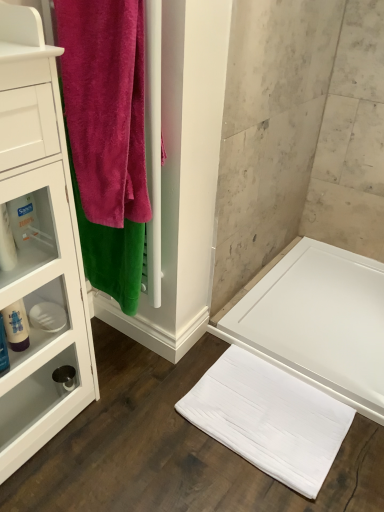
What do you see at coordinates (16, 326) in the screenshot? I see `translucent plastic bottle at left` at bounding box center [16, 326].

At what (x,y) coordinates should I click in order to perform the action: click on matte black faucet at lower left, which ranks as the first toiletry in back-to-front order. Please return your answer as a coordinate pair (x, y). Looking at the image, I should click on (64, 379).

Measure the distance between white glossy bath at lower right and camera.

A distance of 1.40 meters exists between white glossy bath at lower right and camera.

Image resolution: width=384 pixels, height=512 pixels. In order to click on white glossy bath at lower right in this screenshot , I will do `click(319, 322)`.

Where is `white plastic container at left, placed as the third toiletry when sorted from bottom to top`? The height and width of the screenshot is (512, 384). white plastic container at left, placed as the third toiletry when sorted from bottom to top is located at coordinates (6, 242).

What do you see at coordinates (3, 348) in the screenshot?
I see `translucent plastic bottle at left, the 2th toiletry from the back` at bounding box center [3, 348].

Find the location of a particular element. The image size is (384, 512). translucent plastic bottle at left, the 2th toiletry from the back is located at coordinates (3, 348).

You are a GUI agent. You are given a task and a screenshot of the screen. Output one action in this format:
    pyautogui.click(x=<x>, y=<y>)
    Task: Click on the white glossy cabinet at left
    The width and height of the screenshot is (384, 512).
    Given the screenshot: What is the action you would take?
    pyautogui.click(x=39, y=245)

Is velvety pink towel at left at the back of translucent plastic bottle at left, positioned as the second toiletry in front-to-back order?

That's not correct — translucent plastic bottle at left, positioned as the second toiletry in front-to-back order, is not looking away from velvety pink towel at left.

Is translucent plastic bottle at left, positioned as the second toiletry in front-to-back order, taller than velvety pink towel at left?

No, translucent plastic bottle at left, positioned as the second toiletry in front-to-back order, is not taller than velvety pink towel at left.

Between point (3, 353) and point (120, 22), which one is positioned behind?

The point (3, 353) is behind.

Between translucent plastic bottle at left, the 2th toiletry positioned from the top, and velvety pink towel at left, which one is positioned in front?

velvety pink towel at left is closer to the camera.

From a real-world perspective, who is located lower, white soft towel at lower center or translucent plastic bottle at left, the second toiletry in the bottom-to-top sequence?

white soft towel at lower center.

Is white soft towel at lower center shorter than translucent plastic bottle at left, the 2th toiletry positioned from the top?

Yes.

Is white soft towel at lower center positioned beyond the bounds of translucent plastic bottle at left, the second toiletry in the bottom-to-top sequence?

That's correct, white soft towel at lower center is outside of translucent plastic bottle at left, the second toiletry in the bottom-to-top sequence.

Where is `toiletry behind the translucent plastic bottle at left`? The image size is (384, 512). toiletry behind the translucent plastic bottle at left is located at coordinates (64, 379).

From a real-world perspective, which object rests below the other?

matte black faucet at lower left, which ranks as the first toiletry in back-to-front order, from a real-world perspective.

In the scene shown: Considering the sizes of matte black faucet at lower left, the 1th toiletry ordered from the bottom, and translucent plastic bottle at left in the image, is matte black faucet at lower left, the 1th toiletry ordered from the bottom, taller or shorter than translucent plastic bottle at left?

Considering their sizes, matte black faucet at lower left, the 1th toiletry ordered from the bottom, has less height than translucent plastic bottle at left.

Are matte black faucet at lower left, the 3th toiletry from the top, and translucent plastic bottle at left located far from each other?

No, there isn't a large distance between matte black faucet at lower left, the 3th toiletry from the top, and translucent plastic bottle at left.

Could you measure the distance between velvety pink towel at left and matte black faucet at lower left, the 1th toiletry ordered from the bottom?

velvety pink towel at left and matte black faucet at lower left, the 1th toiletry ordered from the bottom, are 31.09 inches apart.

From a real-world perspective, is velvety pink towel at left below matte black faucet at lower left, which ranks as the first toiletry in back-to-front order?

No, from a real-world perspective, velvety pink towel at left is not under matte black faucet at lower left, which ranks as the first toiletry in back-to-front order.

Consider the image. Which of these two, velvety pink towel at left or matte black faucet at lower left, the 3th toiletry from the top, is wider?

velvety pink towel at left is wider.

Which point is more forward, (91, 215) or (66, 369)?

The point (91, 215) is in front.

Where is `bath on the right of the translucent plastic bottle at left, positioned as the second toiletry in front-to-back order`? bath on the right of the translucent plastic bottle at left, positioned as the second toiletry in front-to-back order is located at coordinates (319, 322).

Is translucent plastic bottle at left, the second toiletry in the bottom-to-top sequence, a part of white glossy bath at lower right?

No, translucent plastic bottle at left, the second toiletry in the bottom-to-top sequence, is located outside of white glossy bath at lower right.

Is white glossy bath at lower right touching translucent plastic bottle at left, positioned as the second toiletry in front-to-back order?

They are not placed beside each other.

Does point (383, 367) appear closer or farther from the camera than point (6, 350)?

Clearly, point (383, 367) is more distant from the camera than point (6, 350).

Can we say translucent plastic bottle at left, the second toiletry in the bottom-to-top sequence, lies outside white soft towel at lower center?

Absolutely, translucent plastic bottle at left, the second toiletry in the bottom-to-top sequence, is external to white soft towel at lower center.

Between point (2, 340) and point (287, 482), which one is positioned in front?

The point (2, 340) is closer to the camera.

Based on the photo, is translucent plastic bottle at left, positioned as the second toiletry in front-to-back order, aimed at white soft towel at lower center?

No, translucent plastic bottle at left, positioned as the second toiletry in front-to-back order, is not facing towards white soft towel at lower center.

Is white glossy cabinet at left facing towards white soft towel at lower center?

No, white glossy cabinet at left is not aimed at white soft towel at lower center.

Considering the sizes of objects white glossy cabinet at left and white soft towel at lower center in the image provided, who is smaller, white glossy cabinet at left or white soft towel at lower center?

Smaller between the two is white soft towel at lower center.

Does white glossy cabinet at left have a greater width compared to white soft towel at lower center?

Incorrect, the width of white glossy cabinet at left does not surpass that of white soft towel at lower center.

Identify the location of towel above the translucent plastic bottle at left, the 2th toiletry from the back (from a real-world perspective). (105, 106).

At what (x,y) coordinates should I click in order to perform the action: click on bath towel located behind the translucent plastic bottle at left, the 2th toiletry from the back. Please return your answer as a coordinate pair (x, y). This screenshot has width=384, height=512. Looking at the image, I should click on (269, 419).

From the image, which object appears to be farther from matte black faucet at lower left, placed as the 3th toiletry when sorted from front to back, translucent plastic bottle at left or white glossy bath at lower right?

Based on the image, white glossy bath at lower right appears to be further to matte black faucet at lower left, placed as the 3th toiletry when sorted from front to back.

Estimate the real-world distances between objects in this image. Which object is closer to white soft towel at lower center, white glossy bath at lower right or velvety pink towel at left?

The object closer to white soft towel at lower center is white glossy bath at lower right.

Estimate the real-world distances between objects in this image. Which object is further from white soft towel at lower center, matte black faucet at lower left, the 1th toiletry ordered from the bottom, or white glossy cabinet at left?

matte black faucet at lower left, the 1th toiletry ordered from the bottom, lies further to white soft towel at lower center than the other object.

Based on their spatial positions, is translucent plastic bottle at left, the 2th toiletry from the back, or white glossy bath at lower right closer to white glossy cabinet at left?

The object closer to white glossy cabinet at left is translucent plastic bottle at left, the 2th toiletry from the back.

Considering their positions, is white soft towel at lower center positioned further to translucent plastic bottle at left than white glossy bath at lower right?

white glossy bath at lower right lies further to translucent plastic bottle at left than the other object.

From the image, which object appears to be farther from translucent plastic bottle at left, white glossy bath at lower right or matte black faucet at lower left, the 1th toiletry ordered from the bottom?

white glossy bath at lower right lies further to translucent plastic bottle at left than the other object.

Looking at the image, which one is located further to translucent plastic bottle at left, positioned as the second toiletry in front-to-back order, white plastic container at left, the third toiletry positioned from the back, or white soft towel at lower center?

white soft towel at lower center lies further to translucent plastic bottle at left, positioned as the second toiletry in front-to-back order, than the other object.

When comparing their distances from translucent plastic bottle at left, does translucent plastic bottle at left, the 2th toiletry positioned from the top, or white plastic container at left, arranged as the 1th toiletry when viewed from the front, seem closer?

translucent plastic bottle at left, the 2th toiletry positioned from the top, is positioned closer to the anchor translucent plastic bottle at left.

Identify the location of toiletry located between white glossy cabinet at left and translucent plastic bottle at left, the 2th toiletry positioned from the top, in the depth direction. (6, 242).

The height and width of the screenshot is (512, 384). What are the coordinates of `bath towel between matte black faucet at lower left, which ranks as the first toiletry in back-to-front order, and white glossy bath at lower right` in the screenshot? It's located at pos(269,419).

Identify the location of cleaning product between white plastic container at left, arranged as the 1th toiletry when viewed from the front, and translucent plastic bottle at left, the 2th toiletry positioned from the top, in the vertical direction. Image resolution: width=384 pixels, height=512 pixels. (16, 326).

Locate an element on the screen. towel situated between white plastic container at left, the third toiletry positioned from the back, and white glossy bath at lower right from left to right is located at coordinates (105, 106).